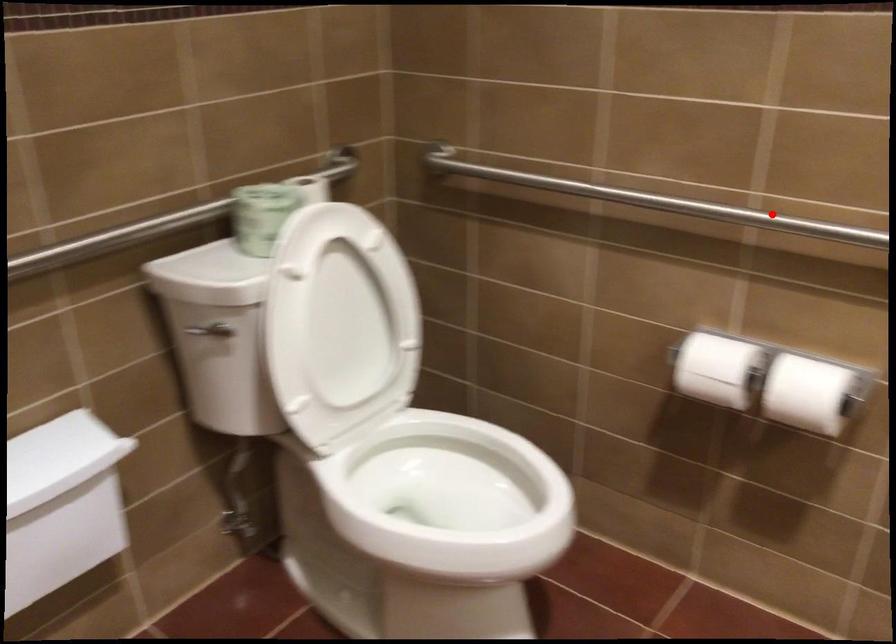
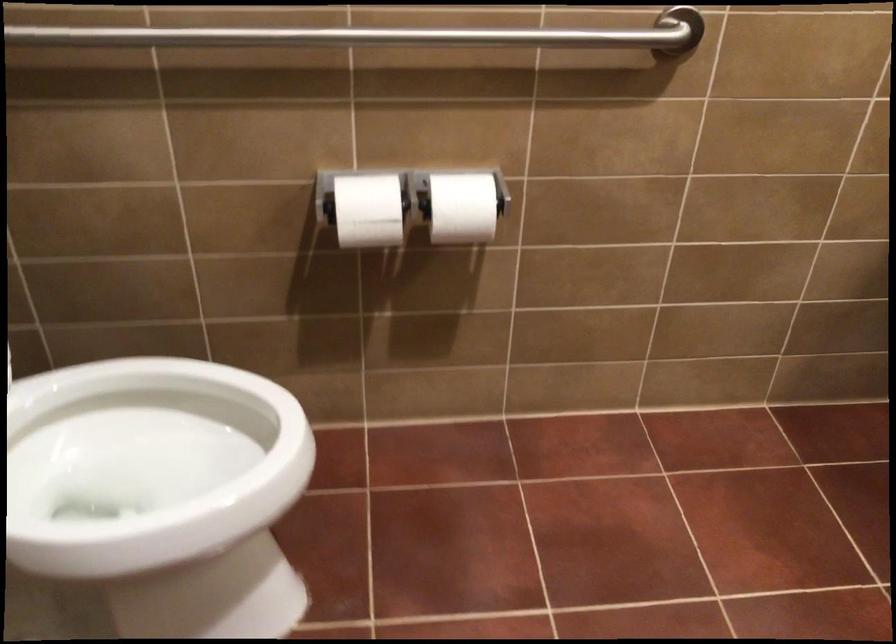
Find the pixel in the second image that matches the highlighted location in the first image.

(378, 35)